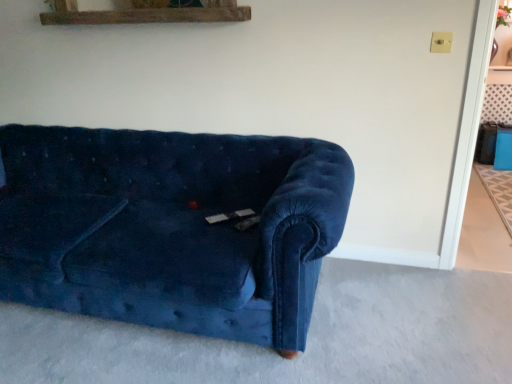
Question: Could velvet couch at lower left, marked as the 1th concrete in a left-to-right arrangement, be considered to be inside velvet blue couch at center?

Choices:
 (A) yes
 (B) no

Answer: (B)

Question: Is velvet blue couch at center in front of velvet couch at lower left, which is counted as the first concrete, starting from the front?

Choices:
 (A) no
 (B) yes

Answer: (A)

Question: Is velvet blue couch at center facing away from velvet couch at lower left, the 2th concrete when ordered from top to bottom?

Choices:
 (A) yes
 (B) no

Answer: (B)

Question: Is velvet blue couch at center taller than velvet couch at lower left, the 2th concrete positioned from the right?

Choices:
 (A) no
 (B) yes

Answer: (B)

Question: Could you tell me if velvet blue couch at center is turned towards velvet couch at lower left, marked as the 1th concrete in a left-to-right arrangement?

Choices:
 (A) no
 (B) yes

Answer: (A)

Question: In the image, is velvet couch at lower left, the 2th concrete positioned from the right, positioned in front of or behind velvet blue couch at center?

Choices:
 (A) behind
 (B) front

Answer: (B)

Question: Is velvet couch at lower left, the 2th concrete when ordered from top to bottom, bigger or smaller than velvet blue couch at center?

Choices:
 (A) big
 (B) small

Answer: (B)

Question: Is velvet couch at lower left, marked as the 1th concrete in a left-to-right arrangement, wider or thinner than velvet blue couch at center?

Choices:
 (A) thin
 (B) wide

Answer: (B)

Question: Considering the relative positions of velvet couch at lower left, the 2th concrete positioned from the back, and velvet blue couch at center in the image provided, is velvet couch at lower left, the 2th concrete positioned from the back, to the left or to the right of velvet blue couch at center?

Choices:
 (A) left
 (B) right

Answer: (B)

Question: Would you say velvet couch at lower left, the 2th concrete positioned from the back, is to the left or to the right of beige carpet at lower right, which appears as the first concrete when viewed from the top, in the picture?

Choices:
 (A) right
 (B) left

Answer: (B)

Question: Considering the positions of point pos(426,271) and point pos(483,268), is point pos(426,271) closer or farther from the camera than point pos(483,268)?

Choices:
 (A) farther
 (B) closer

Answer: (B)

Question: In the image, is velvet couch at lower left, the first concrete from the bottom, positioned in front of or behind beige carpet at lower right, which is counted as the 2th concrete, starting from the bottom?

Choices:
 (A) behind
 (B) front

Answer: (B)

Question: Is velvet couch at lower left, the first concrete from the bottom, bigger or smaller than beige carpet at lower right, which is counted as the 2th concrete, starting from the bottom?

Choices:
 (A) big
 (B) small

Answer: (A)

Question: Do you think beige carpet at lower right, which appears as the first concrete when viewed from the top, is within velvet couch at lower left, the 2th concrete positioned from the back, or outside of it?

Choices:
 (A) inside
 (B) outside

Answer: (B)

Question: Considering the positions of beige carpet at lower right, the 1th concrete when ordered from right to left, and velvet couch at lower left, the 2th concrete positioned from the right, in the image, is beige carpet at lower right, the 1th concrete when ordered from right to left, bigger or smaller than velvet couch at lower left, the 2th concrete positioned from the right,?

Choices:
 (A) small
 (B) big

Answer: (A)